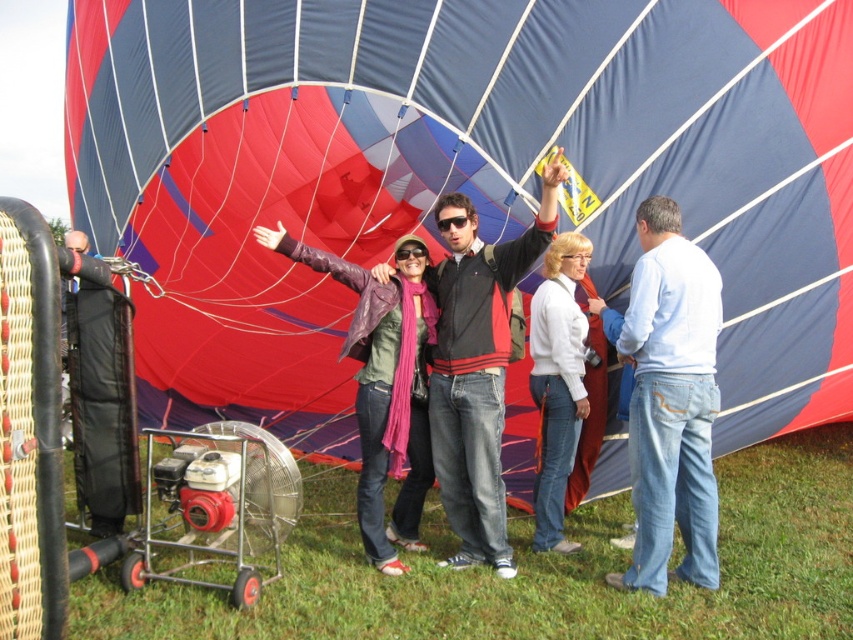
Question: Can you confirm if white cotton shirt at right is positioned to the left of white matte jacket at center?

Choices:
 (A) yes
 (B) no

Answer: (B)

Question: Does white cotton shirt at right appear under black plastic goggles at center?

Choices:
 (A) no
 (B) yes

Answer: (B)

Question: Among these objects, which one is nearest to the camera?

Choices:
 (A) black plastic goggles at center
 (B) pink fabric goggles at center
 (C) white cotton shirt at right
 (D) white matte jacket at center

Answer: (C)

Question: Is white cotton shirt at right bigger than white matte jacket at center?

Choices:
 (A) no
 (B) yes

Answer: (B)

Question: Considering the real-world distances, which object is closest to the black plastic goggles at center?

Choices:
 (A) purple leather jacket at center
 (B) white matte jacket at center
 (C) blue fabric balloon at center

Answer: (A)

Question: Which point is closer to the camera taking this photo?

Choices:
 (A) (807, 234)
 (B) (399, 433)
 (C) (659, 372)

Answer: (C)